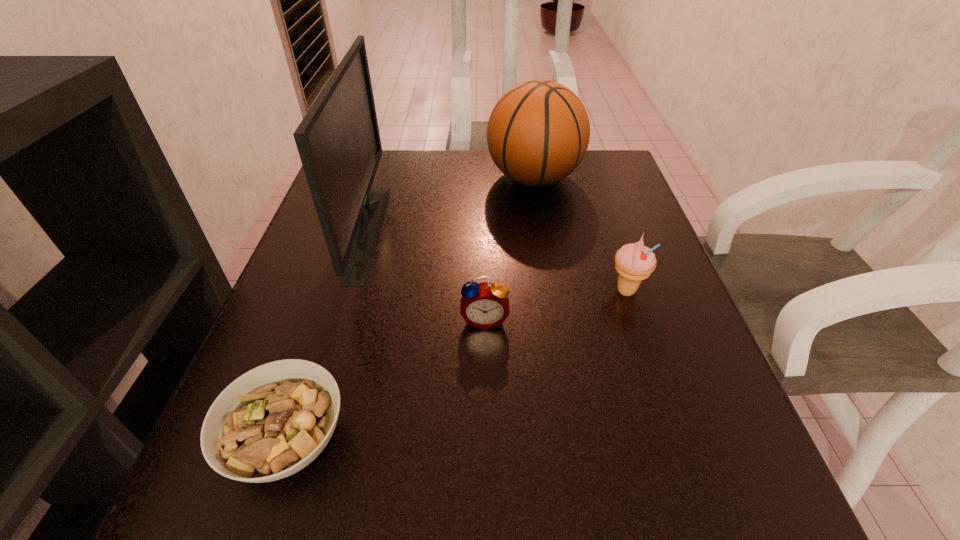
Where is `object that is at the near left corner`? Image resolution: width=960 pixels, height=540 pixels. object that is at the near left corner is located at coordinates [x=271, y=422].

Identify the location of object at the far right corner. (538, 132).

Identify the location of vacant space at the far edge. (412, 177).

The width and height of the screenshot is (960, 540). I want to click on free space at the near edge of the desktop, so click(x=564, y=500).

Where is `free space at the left edge of the desktop`? free space at the left edge of the desktop is located at coordinates (311, 295).

What are the coordinates of `vacant space at the right edge` in the screenshot? It's located at (617, 272).

In order to click on vacant space at the far left corner of the desktop in this screenshot , I will do `click(370, 193)`.

In the image, there is a desktop. Where is `blank space at the far right corner`? blank space at the far right corner is located at coordinates (604, 156).

Locate an element on the screen. The image size is (960, 540). vacant space in between the icecream and the second tallest object is located at coordinates (580, 234).

This screenshot has height=540, width=960. Find the location of `vacant area that lies between the icecream and the fourth farthest object`. vacant area that lies between the icecream and the fourth farthest object is located at coordinates (555, 305).